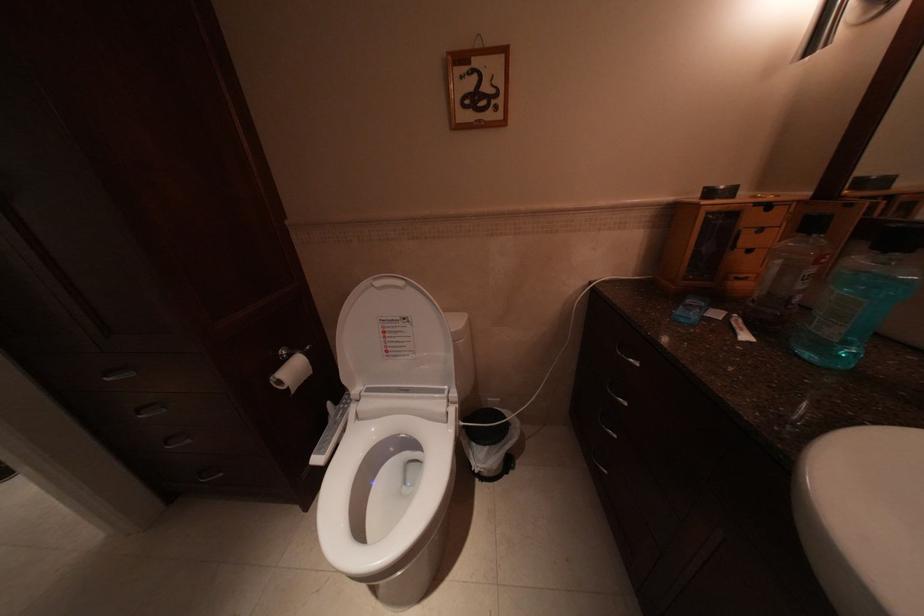
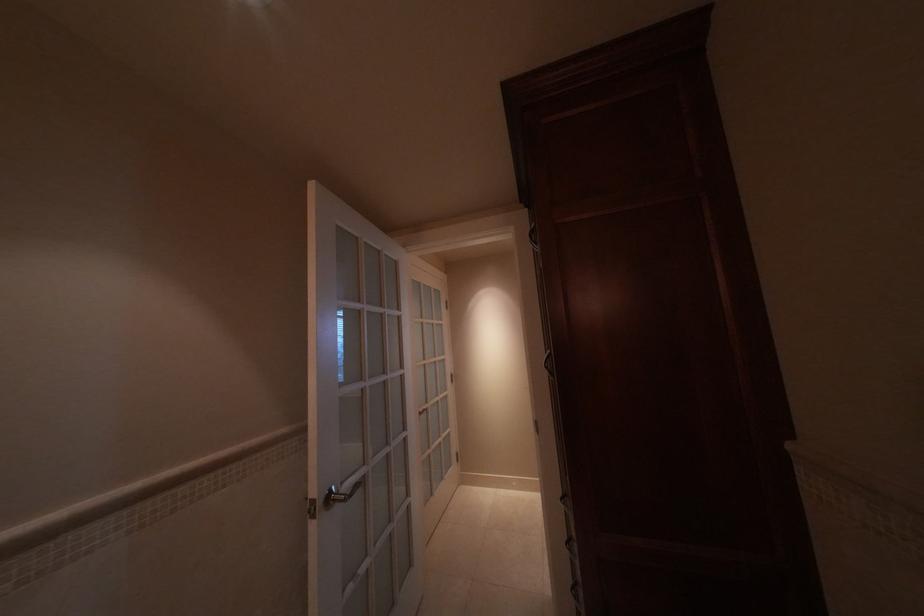
Question: The camera is either moving clockwise (left) or counter-clockwise (right) around the object. The first image is from the beginning of the video and the second image is from the end. Is the camera moving left or right when shooting the video?

Choices:
 (A) Left
 (B) Right

Answer: (B)